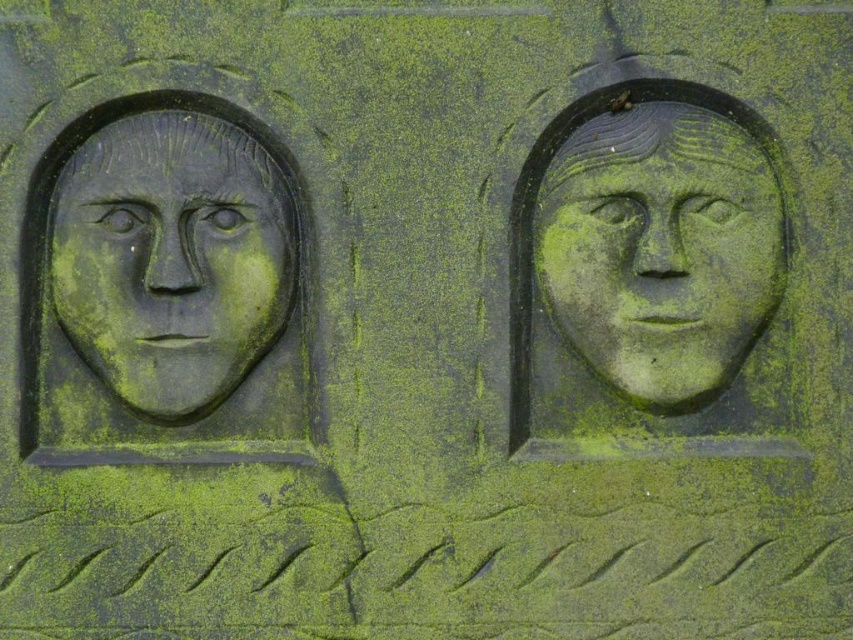
Which is more to the left, matte stone face at upper right or matte stone face at left?

Positioned to the left is matte stone face at left.

Locate an element on the screen. The image size is (853, 640). matte stone face at upper right is located at coordinates (660, 250).

The image size is (853, 640). Identify the location of matte stone face at upper right. (660, 250).